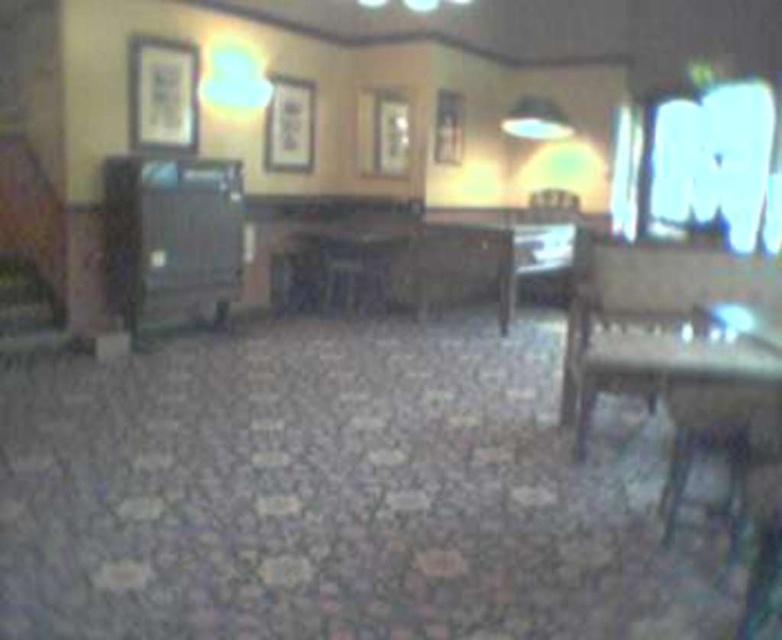
Question: Is wooden table at lower right positioned before matte white lampshade at upper center?

Choices:
 (A) yes
 (B) no

Answer: (A)

Question: Is wooden table at lower right above matte white lampshade at upper center?

Choices:
 (A) no
 (B) yes

Answer: (A)

Question: Among these objects, which one is nearest to the camera?

Choices:
 (A) wooden table at lower right
 (B) matte white lampshade at upper center

Answer: (A)

Question: In this image, where is wooden table at lower right located relative to matte white lampshade at upper center?

Choices:
 (A) below
 (B) above

Answer: (A)

Question: Which of the following is the closest to the observer?

Choices:
 (A) (542, 128)
 (B) (666, 522)

Answer: (B)